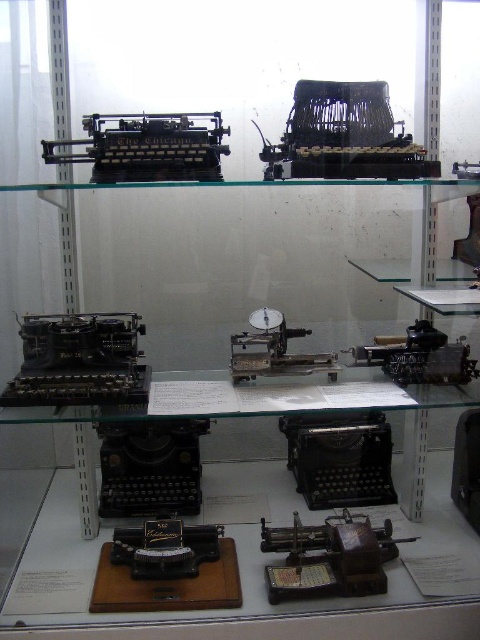
Question: Does matte black typewriter at upper center have a greater width compared to black metal typewriter at upper left?

Choices:
 (A) no
 (B) yes

Answer: (A)

Question: Which point is farther to the camera?

Choices:
 (A) black metal typewriter at upper left
 (B) matte black typewriter at upper center

Answer: (B)

Question: Which of the following is the closest to the observer?

Choices:
 (A) matte black typewriter at upper center
 (B) black metal typewriter at upper left

Answer: (B)

Question: Does matte black typewriter at upper center have a smaller size compared to black metal typewriter at upper left?

Choices:
 (A) no
 (B) yes

Answer: (A)

Question: From the image, what is the correct spatial relationship of matte black typewriter at upper center in relation to black metal typewriter at upper left?

Choices:
 (A) above
 (B) below

Answer: (A)